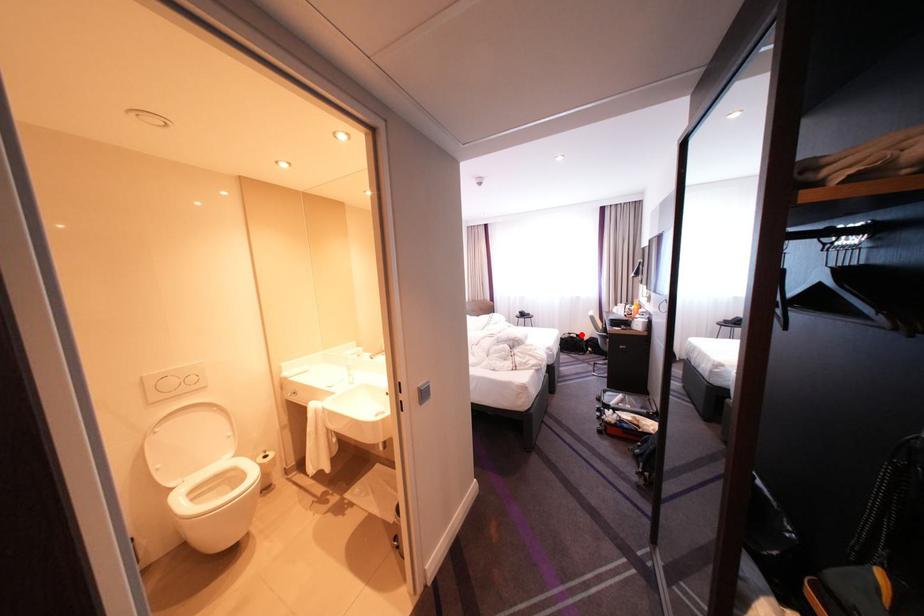
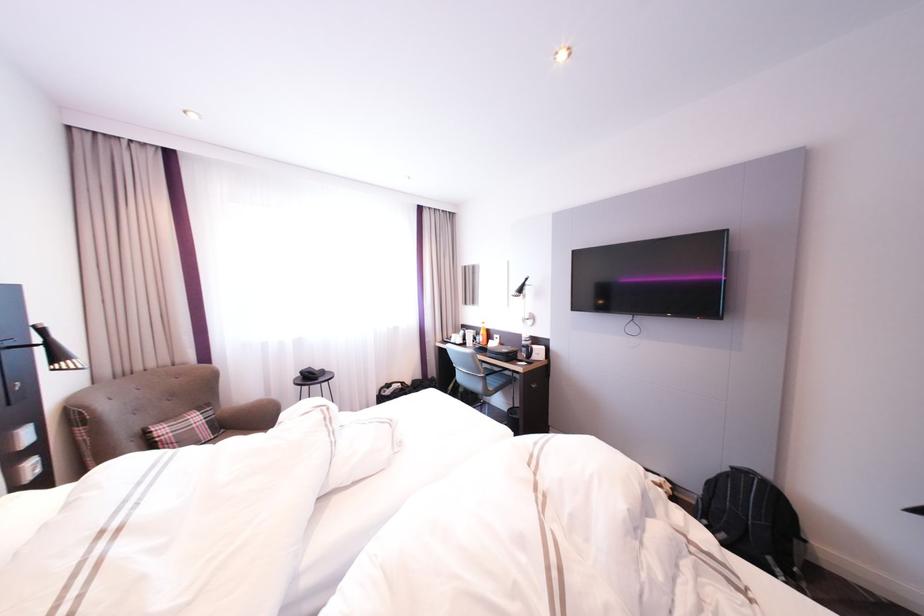
Question: I am providing you with two images of the same scene from different viewpoints. A red point is shown in image1. For the corresponding object point in image2, is it positioned nearer or farther from the camera?

Choices:
 (A) Nearer
 (B) Farther

Answer: (A)